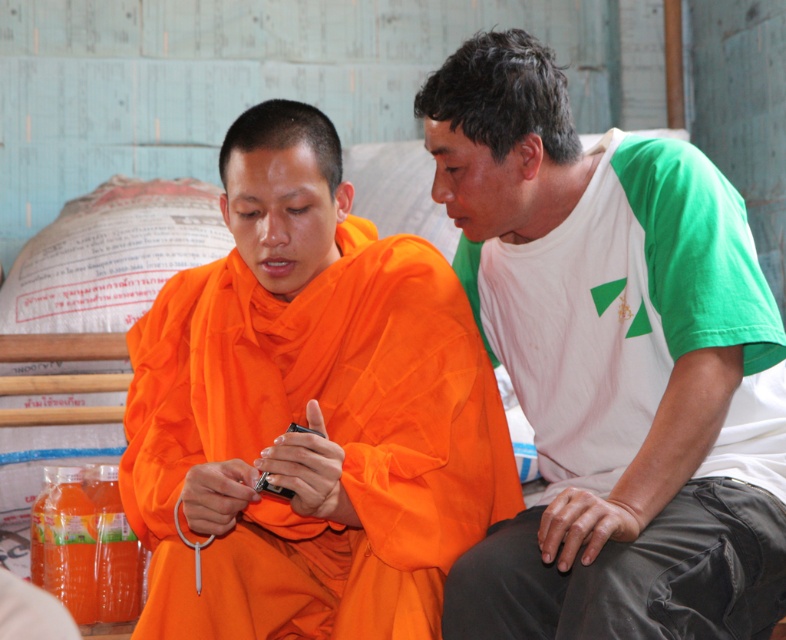
Does white-green t-shirt at right lie behind orange cloth at center?

No.

Does point (678, 560) come behind point (446, 403)?

No, it is in front of (446, 403).

The image size is (786, 640). Identify the location of white-green t-shirt at right. (612, 365).